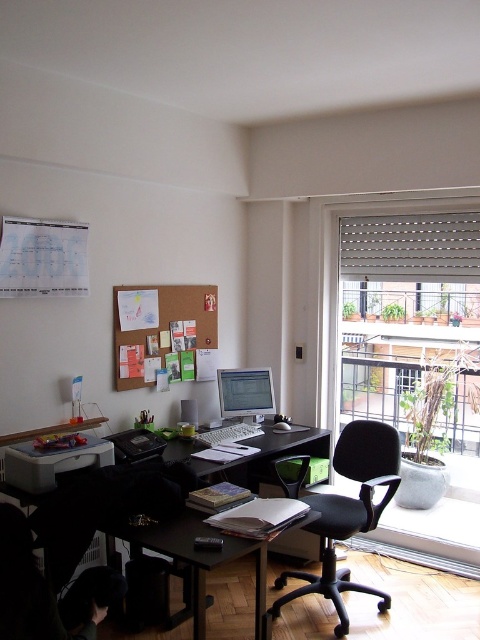
You are organizing your home office and want to place a new plant between the white fabric blind at upper right and the corkboard at upper center. Based on their positions, where should you place the plant?

The white fabric blind at upper right is to the right of the corkboard at upper center, so you should place the plant between them, positioning it to the right of the corkboard at upper center and to the left of the white fabric blind at upper right.

You are organizing your home office and want to hang a new poster. You have a choice between placing it on the corkboard at upper center or above the roller blinds at right. Considering the current setup, where would the poster be more visible?

The poster would be more visible if placed above the roller blinds at right because the corkboard at upper center is behind the roller blinds at right, which might block the view.

You are a delivery person who needs to place a package on the desk. The package is 1.6 meters long. Can you fit the package horizontally between the roller blinds at right and the corkboard at upper center?

The distance between the roller blinds at right and the corkboard at upper center is 1.59 meters. Since the package is 1.6 meters long, it is slightly longer than the available space. Therefore, the package cannot be placed horizontally between them.